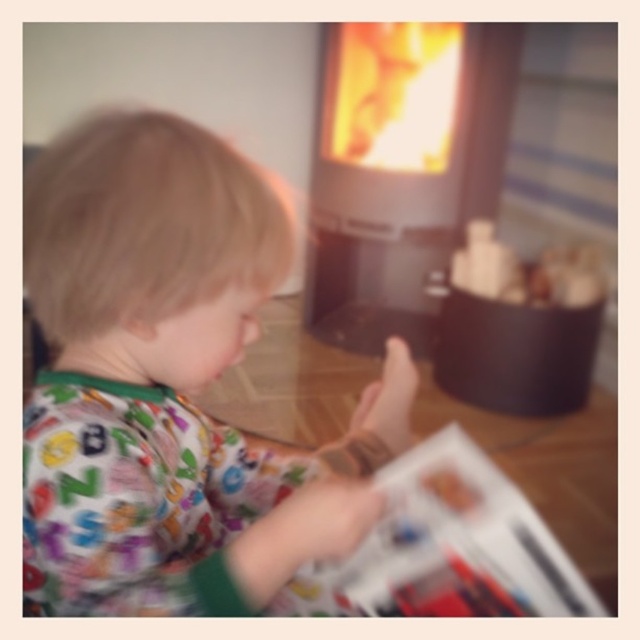
You are standing in a room with two points marked in the image. The first point is at coordinates point (x=368, y=134) and the second is at point (x=513, y=513). Which point is closer to you?

Point (x=368, y=134) is closer to you because it is further to the viewer than point (x=513, y=513).

You are a tailor measuring fabrics for a project. You have a printed fabric shirt at center and a printed paper magazine at lower center in front of you. Which object has a greater width?

The printed fabric shirt at center has a greater width than the printed paper magazine at lower center according to the description.